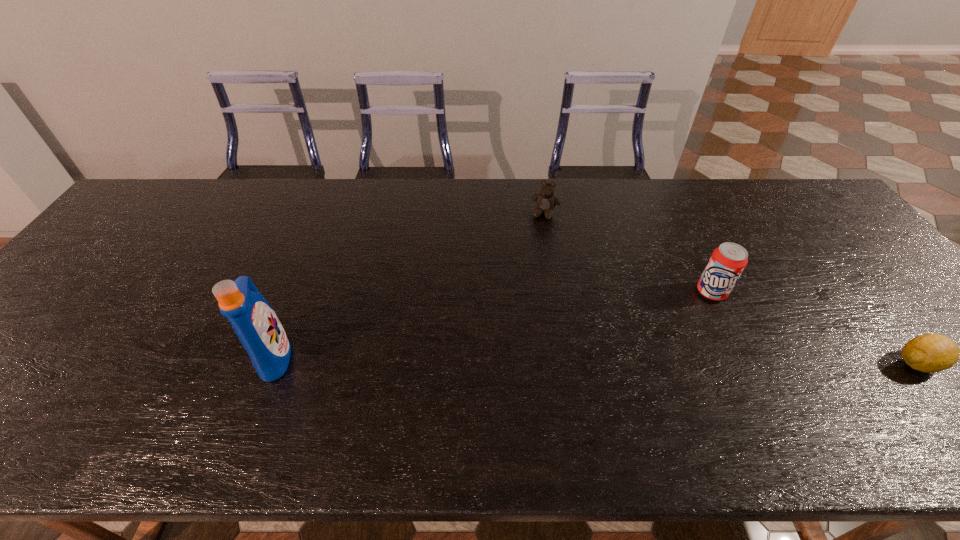
Locate an element on the screen. The height and width of the screenshot is (540, 960). free point located on the face of the teddy bear is located at coordinates (532, 258).

Locate an element on the screen. vacant space located 0.370m on the face of the teddy bear is located at coordinates (516, 310).

This screenshot has width=960, height=540. Identify the location of free point located on the surface of the second object from right to left. (682, 329).

Where is `vacant space located 0.370m on the surface of the second object from right to left`? Image resolution: width=960 pixels, height=540 pixels. vacant space located 0.370m on the surface of the second object from right to left is located at coordinates (630, 392).

You are a GUI agent. You are given a task and a screenshot of the screen. Output one action in this format:
    pyautogui.click(x=<x>, y=<y>)
    Task: Click on the blank area located 0.050m on the surface of the second object from right to left
    
    Given the screenshot: What is the action you would take?
    pyautogui.click(x=696, y=310)

In order to click on object present at the far edge in this screenshot , I will do `click(546, 201)`.

Identify the location of detergent located in the near edge section of the desktop. (257, 326).

Image resolution: width=960 pixels, height=540 pixels. Find the location of `lemon at the near edge`. lemon at the near edge is located at coordinates (930, 353).

Where is `object that is at the right edge`? This screenshot has height=540, width=960. object that is at the right edge is located at coordinates (930, 353).

Locate an element on the screen. This screenshot has height=540, width=960. object that is at the near right corner is located at coordinates (930, 353).